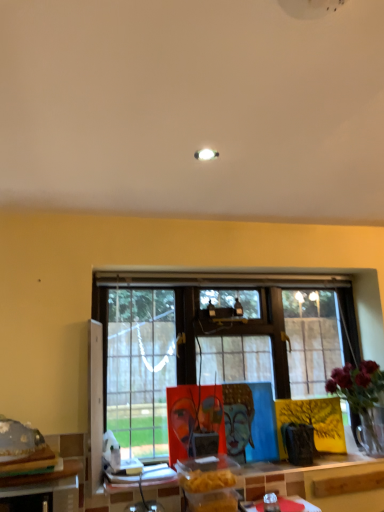
At what (x,y) coordinates should I click in order to perform the action: click on empty space that is ontop of wooden table at lower center, the 1th table positioned from the right. Please return your answer as a coordinate pair (x, y). Looking at the image, I should click on (268, 464).